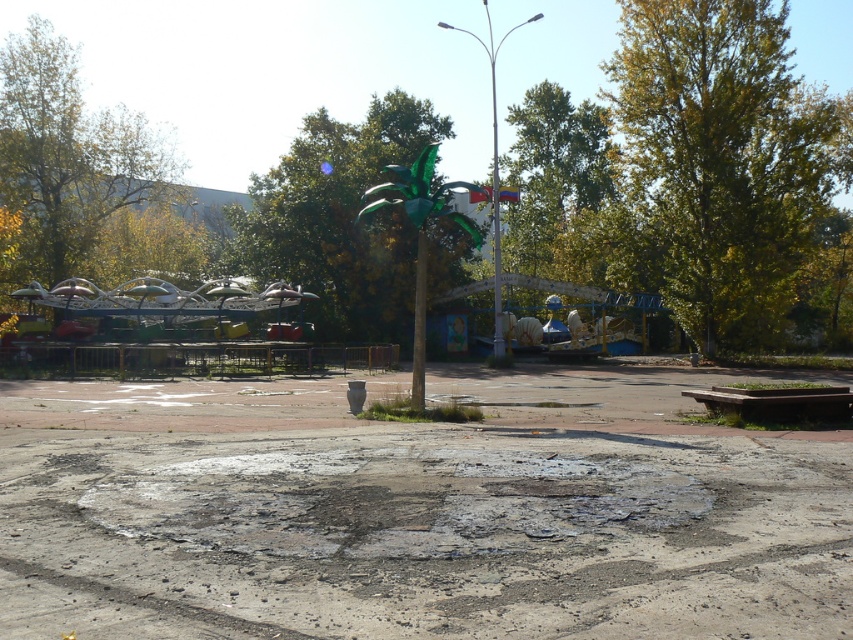
Is point (598, 573) in front of point (194, 314)?

That is True.

Is concrete pavement at center to the left of metallic shiny carousel at left from the viewer's perspective?

Incorrect, concrete pavement at center is not on the left side of metallic shiny carousel at left.

Between point (28, 554) and point (233, 278), which one is positioned in front?

Point (28, 554) is more forward.

The width and height of the screenshot is (853, 640). In order to click on concrete pavement at center in this screenshot , I will do `click(416, 513)`.

Does green metallic tree at center have a lesser width compared to green leafy tree at upper center?

Correct, green metallic tree at center's width is less than green leafy tree at upper center's.

Find the location of `green metallic tree at center`. green metallic tree at center is located at coordinates (340, 218).

Does concrete pavement at center have a greater height compared to green leafy tree at upper right?

Incorrect, concrete pavement at center's height is not larger of green leafy tree at upper right's.

Between concrete pavement at center and green leafy tree at upper right, which one is positioned higher?

green leafy tree at upper right

Measure the distance between concrete pavement at center and camera.

concrete pavement at center and camera are 4.77 meters apart from each other.

The height and width of the screenshot is (640, 853). In order to click on concrete pavement at center in this screenshot , I will do `click(416, 513)`.